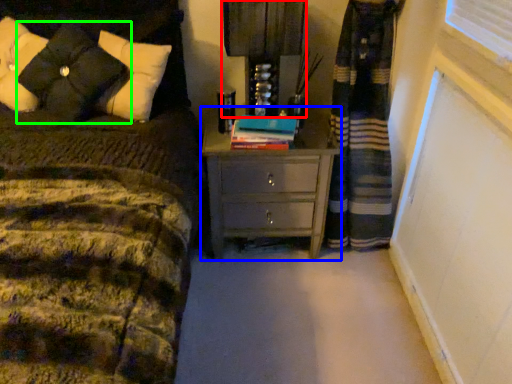
Question: Which object is the closest to the bedside lamp (highlighted by a red box)? Choose among these: chest of drawers (highlighted by a blue box) or pillow (highlighted by a green box).

Choices:
 (A) chest of drawers
 (B) pillow

Answer: (A)